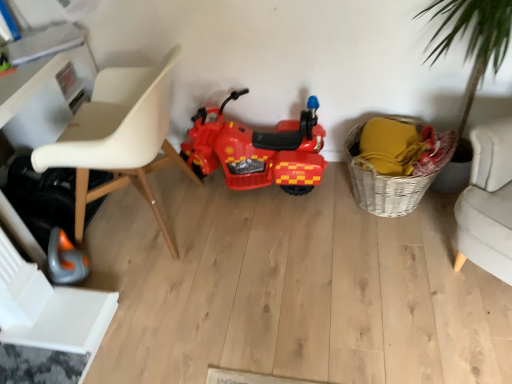
Where is `free point below white plastic chair at left (from a real-world perspective)`? free point below white plastic chair at left (from a real-world perspective) is located at coordinates (151, 219).